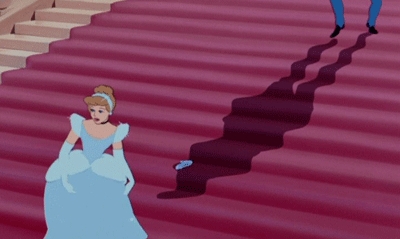
I want to click on beige staircase, so click(61, 25).